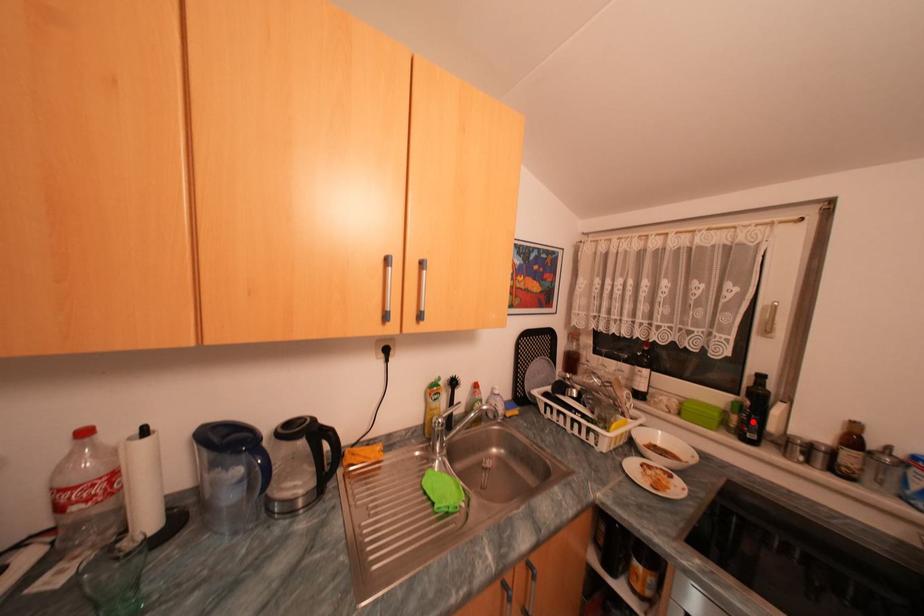
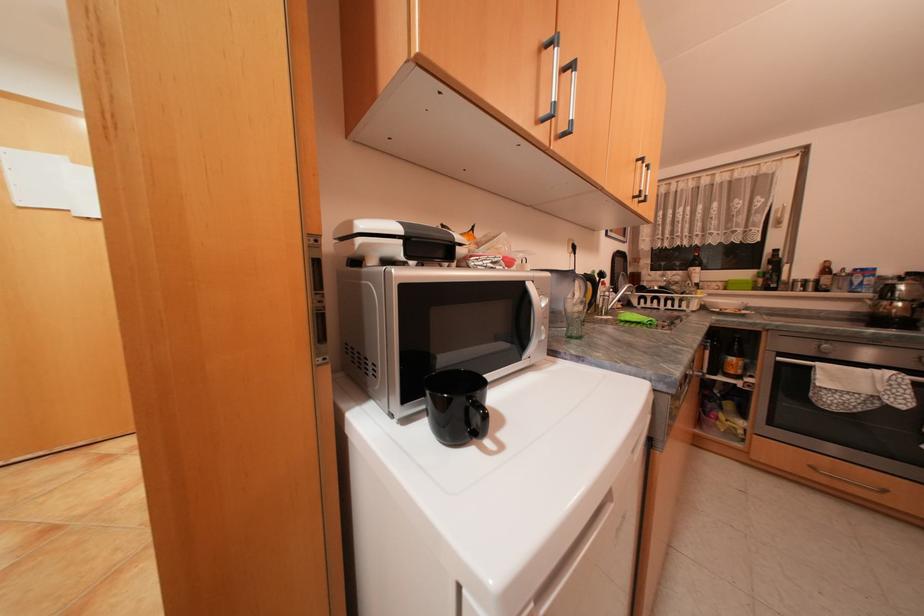
Question: I am providing you with two images of the same scene from different viewpoints. A red point is marked on the first image. Can you still see the location of the red point in image 2?

Choices:
 (A) Yes
 (B) No

Answer: (A)